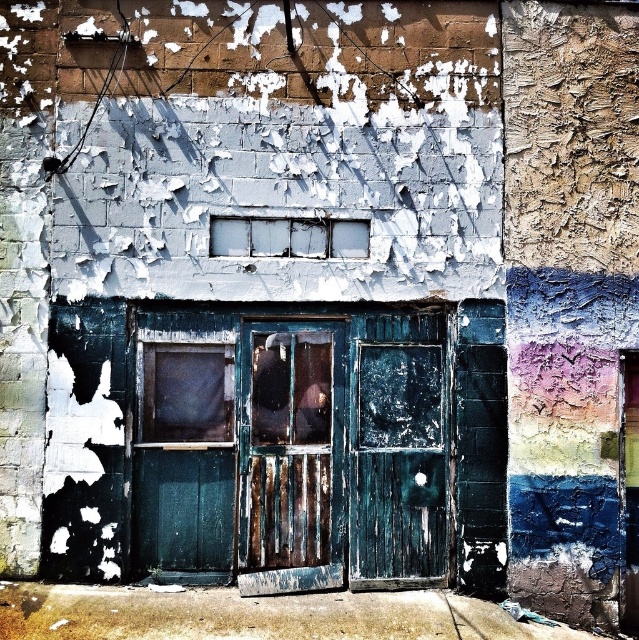
What do you see at coordinates (291, 448) in the screenshot?
I see `teal wooden door at center` at bounding box center [291, 448].

Who is shorter, teal wooden door at center or rusty wood door at center?

Standing shorter between the two is rusty wood door at center.

Is point (185, 515) positioned after point (311, 515)?

No, it is not.

Locate an element on the screen. The height and width of the screenshot is (640, 639). teal wooden door at center is located at coordinates (291, 448).

Which of these two, rusty wood door at center or white frosted glass window at center, stands shorter?

Standing shorter between the two is white frosted glass window at center.

Locate an element on the screen. rusty wood door at center is located at coordinates (289, 456).

How far apart are teal wooden door at center and white frosted glass window at center?

34.85 inches

Does teal wooden door at center have a smaller size compared to white frosted glass window at center?

No.

The image size is (639, 640). In order to click on teal wooden door at center in this screenshot , I will do `click(291, 448)`.